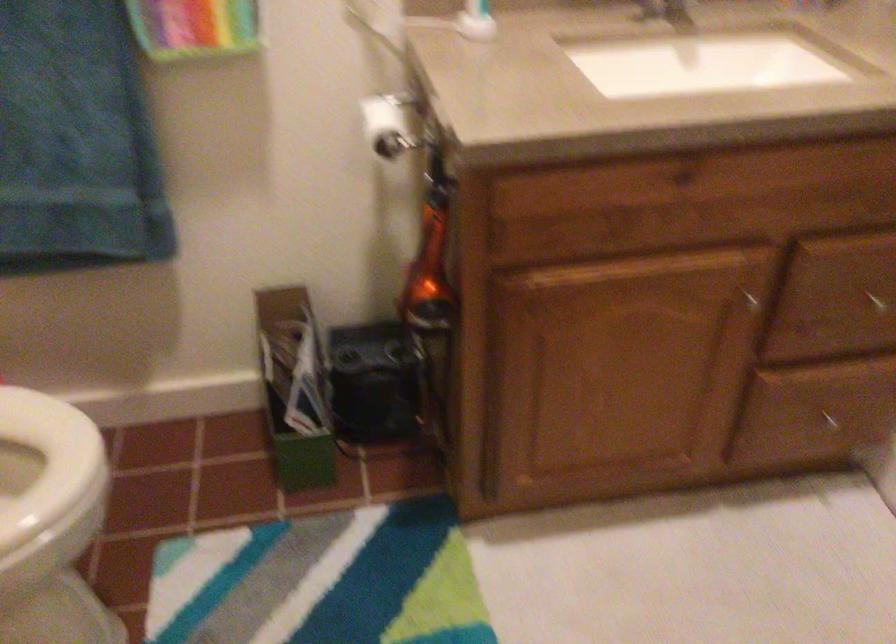
Image resolution: width=896 pixels, height=644 pixels. What do you see at coordinates (47, 466) in the screenshot?
I see `the white toilet seat` at bounding box center [47, 466].